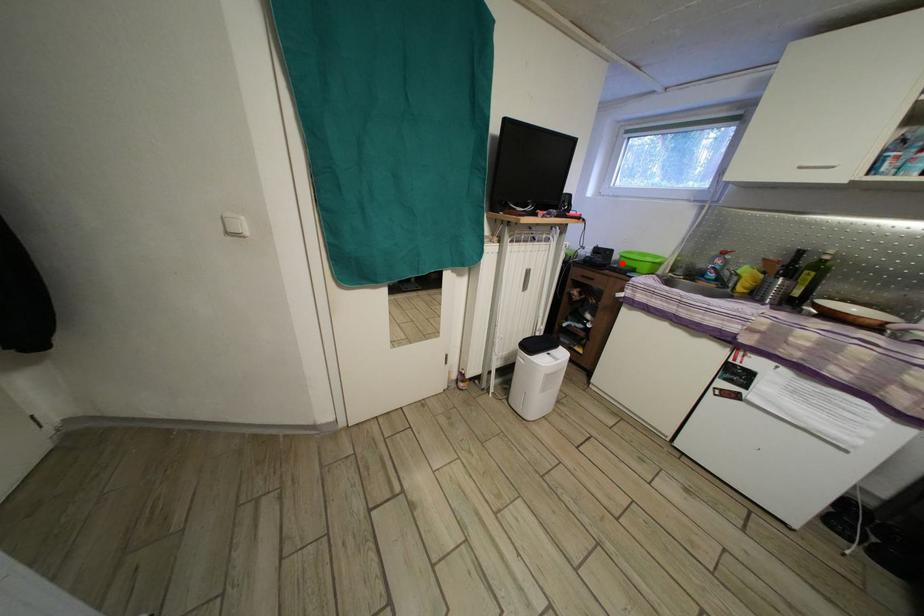
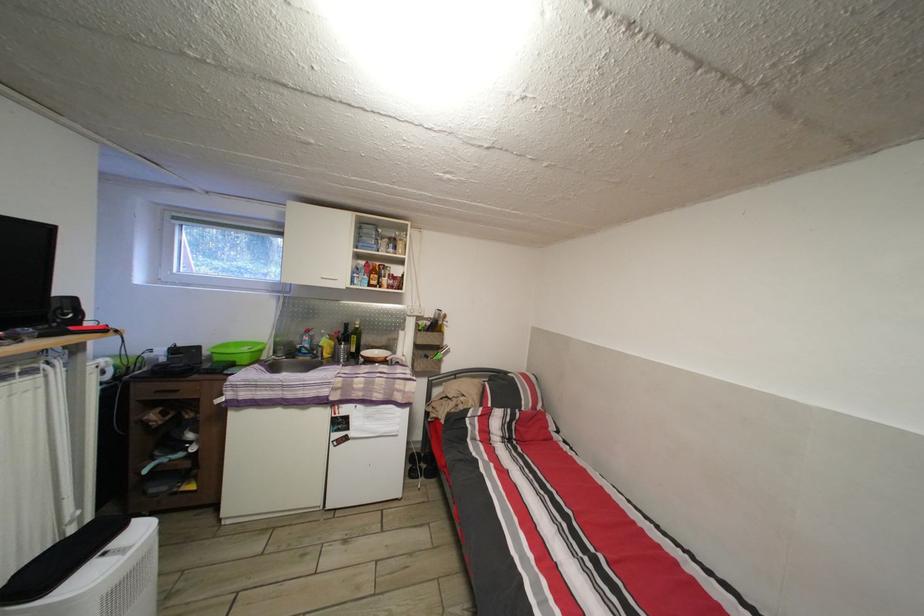
In the second image, find the point that corresponds to the highlighted location in the first image.

(213, 359)